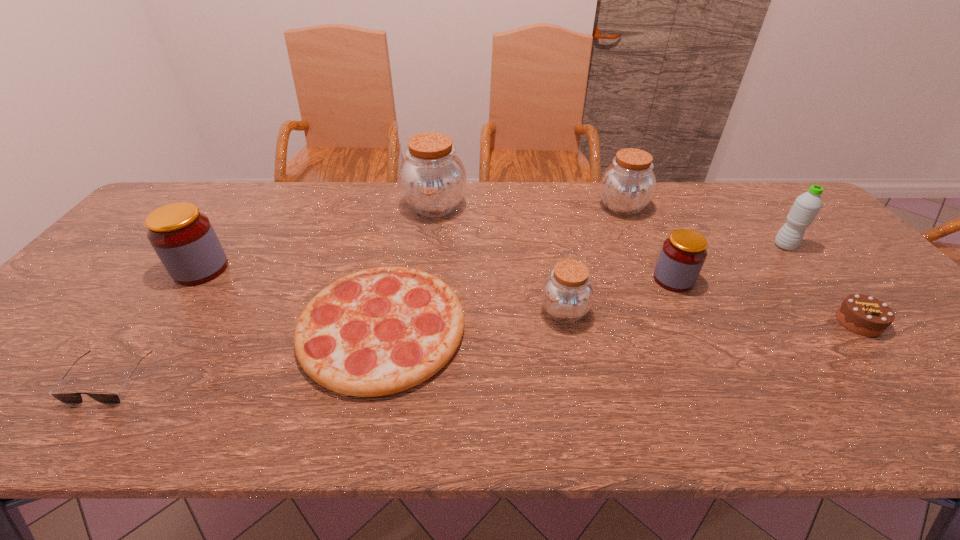
Locate which object is the closest to the brown chocolate cake. Please provide its 2D coordinates. Your answer should be formatted as a tuple, i.e. [(x, y)], where the tuple contains the x and y coordinates of a point satisfying the conditions above.

[(806, 206)]

Identify which jar is located as the third nearest to the pizza. Please provide its 2D coordinates. Your answer should be formatted as a tuple, i.e. [(x, y)], where the tuple contains the x and y coordinates of a point satisfying the conditions above.

[(183, 238)]

Point out which jar is positioned as the second nearest to the rightmost brown jar. Please provide its 2D coordinates. Your answer should be formatted as a tuple, i.e. [(x, y)], where the tuple contains the x and y coordinates of a point satisfying the conditions above.

[(567, 294)]

Locate which brown jar ranks in proximity to the sunglasses. Please provide its 2D coordinates. Your answer should be formatted as a tuple, i.e. [(x, y)], where the tuple contains the x and y coordinates of a point satisfying the conditions above.

[(432, 178)]

Identify which brown jar is the second nearest to the water bottle. Please provide its 2D coordinates. Your answer should be formatted as a tuple, i.e. [(x, y)], where the tuple contains the x and y coordinates of a point satisfying the conditions above.

[(567, 294)]

What are the coordinates of `vacant space that satisfies the following two spatial constraints: 1. on the front side of the smaller red jar; 2. on the right side of the second smallest brown jar` in the screenshot? It's located at (654, 279).

Where is `vacant area that satisfies the following two spatial constraints: 1. on the back side of the left red jar; 2. on the left side of the seventh nearest object`? vacant area that satisfies the following two spatial constraints: 1. on the back side of the left red jar; 2. on the left side of the seventh nearest object is located at coordinates (218, 246).